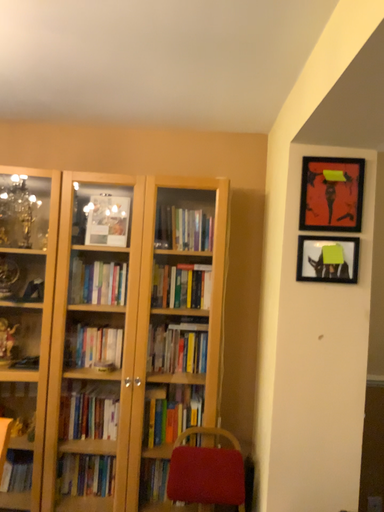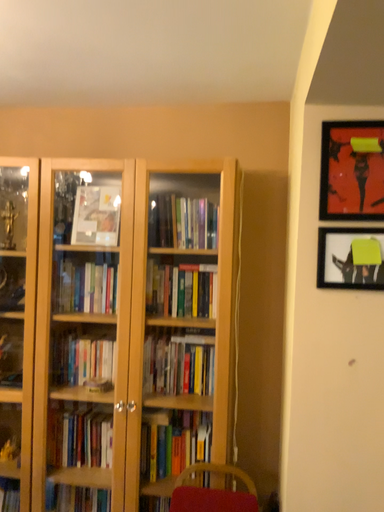
Question: Which way did the camera rotate in the video?

Choices:
 (A) rotated right
 (B) rotated left

Answer: (B)